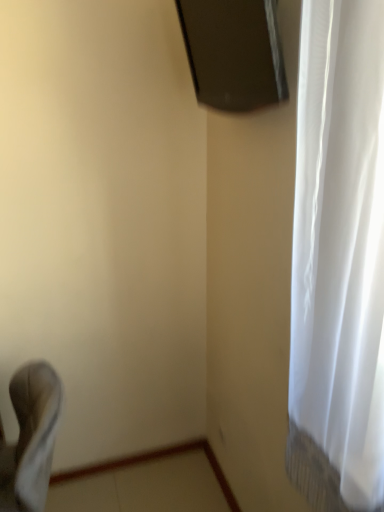
Measure the distance between point (17,454) and camera.

The distance of point (17,454) from camera is 4.19 feet.

The height and width of the screenshot is (512, 384). Describe the element at coordinates (31, 438) in the screenshot. I see `gray fabric chair at lower left` at that location.

This screenshot has height=512, width=384. I want to click on gray fabric chair at lower left, so click(31, 438).

The height and width of the screenshot is (512, 384). I want to click on gray fabric chair at lower left, so click(31, 438).